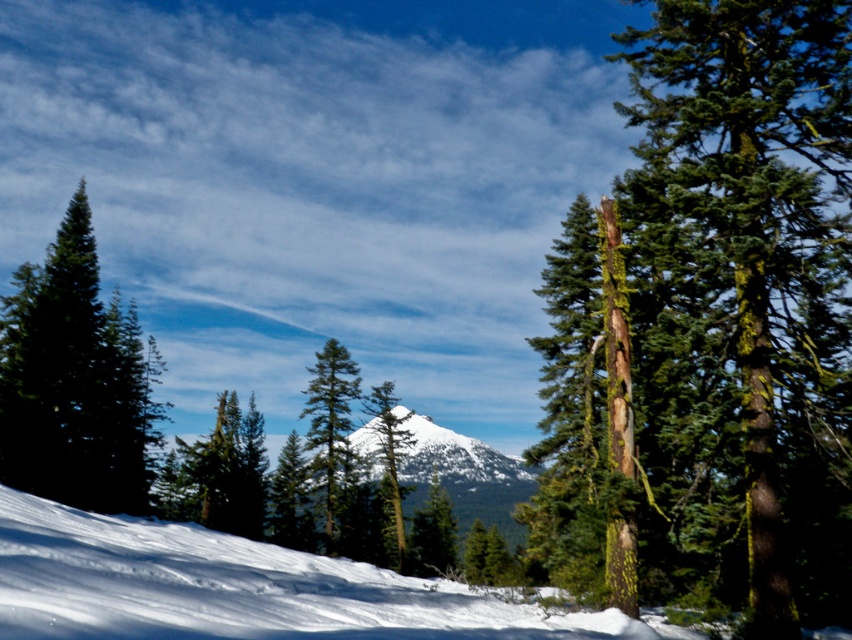
Question: Among these points, which one is nearest to the camera?

Choices:
 (A) (384, 458)
 (B) (47, 410)
 (C) (114, 624)
 (D) (781, 400)

Answer: (C)

Question: Is snowy peak at center wider than green mossy tree at center?

Choices:
 (A) yes
 (B) no

Answer: (A)

Question: Which object is farther from the camera taking this photo?

Choices:
 (A) snowy peak at center
 (B) green matte tree at center
 (C) green mossy tree trunk at right

Answer: (B)

Question: Estimate the real-world distances between objects in this image. Which object is closer to the green mossy tree trunk at right?

Choices:
 (A) white snow at lower left
 (B) green mossy tree at center
 (C) green matte evergreen tree at left
 (D) snowy peak at center

Answer: (A)

Question: Is white snow at lower left further to camera compared to green mossy tree at center?

Choices:
 (A) yes
 (B) no

Answer: (B)

Question: Does white snow at lower left have a larger size compared to snowy peak at center?

Choices:
 (A) no
 (B) yes

Answer: (A)